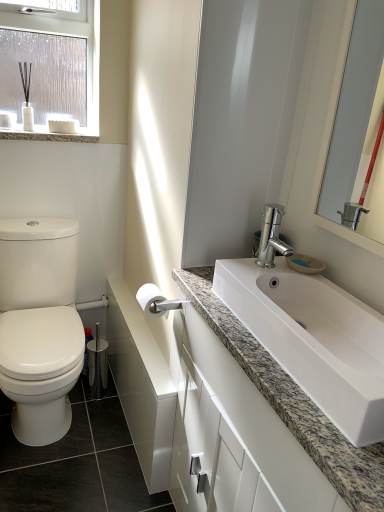
Question: From a real-world perspective, is white glossy cabinet at lower center on top of white glossy cabinet at lower right?

Choices:
 (A) no
 (B) yes

Answer: (B)

Question: Can you confirm if white glossy cabinet at lower center is positioned to the right of white glossy cabinet at lower right?

Choices:
 (A) yes
 (B) no

Answer: (B)

Question: From a real-world perspective, is white glossy cabinet at lower center positioned under white glossy cabinet at lower right based on gravity?

Choices:
 (A) yes
 (B) no

Answer: (B)

Question: Is white glossy cabinet at lower center aimed at white glossy cabinet at lower right?

Choices:
 (A) no
 (B) yes

Answer: (A)

Question: Does white glossy cabinet at lower center have a greater height compared to white glossy cabinet at lower right?

Choices:
 (A) no
 (B) yes

Answer: (A)

Question: Is white glossy cabinet at lower center further to the viewer compared to white glossy cabinet at lower right?

Choices:
 (A) no
 (B) yes

Answer: (B)

Question: Does white matte toilet paper at center lie in front of granite countertop at upper left?

Choices:
 (A) no
 (B) yes

Answer: (B)

Question: From a real-world perspective, is white matte toilet paper at center on top of granite countertop at upper left?

Choices:
 (A) no
 (B) yes

Answer: (A)

Question: Is white matte toilet paper at center positioned behind granite countertop at upper left?

Choices:
 (A) yes
 (B) no

Answer: (B)

Question: Is white matte toilet paper at center directly adjacent to granite countertop at upper left?

Choices:
 (A) yes
 (B) no

Answer: (B)

Question: From the image's perspective, would you say white matte toilet paper at center is positioned over granite countertop at upper left?

Choices:
 (A) yes
 (B) no

Answer: (B)

Question: Can you confirm if white matte toilet paper at center is smaller than granite countertop at upper left?

Choices:
 (A) no
 (B) yes

Answer: (B)

Question: From a real-world perspective, is granite countertop at upper left over white granite sink at center?

Choices:
 (A) no
 (B) yes

Answer: (B)